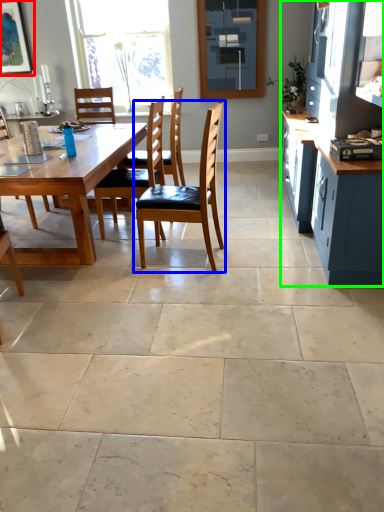
Question: Which is farther away from picture frame (highlighted by a red box)? chair (highlighted by a blue box) or cabinetry (highlighted by a green box)?

Choices:
 (A) chair
 (B) cabinetry

Answer: (B)